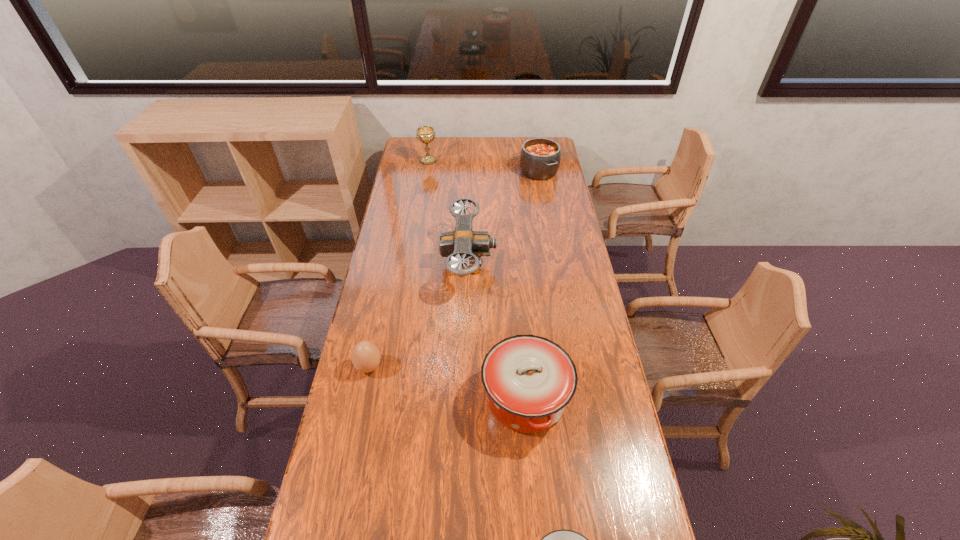
Find the location of a particular element. This screenshot has height=540, width=960. free spot between the fifth tallest object and the chalice is located at coordinates (398, 264).

At what (x,y) coordinates should I click in order to perform the action: click on blank region between the nearer casserole and the chalice. Please return your answer as a coordinate pair (x, y). Looking at the image, I should click on (477, 280).

Locate an element on the screen. free space between the taller casserole and the chalice is located at coordinates (477, 280).

In order to click on unoccupied position between the nearer casserole and the fifth tallest object in this screenshot , I will do `click(447, 382)`.

Locate an element on the screen. This screenshot has height=540, width=960. vacant point located between the chalice and the second shortest object is located at coordinates (398, 264).

The height and width of the screenshot is (540, 960). What are the coordinates of `object that is the fourth closest to the nearer casserole` in the screenshot? It's located at (540, 158).

Identify the location of object identified as the fifth closest to the nearer casserole. (426, 134).

At what (x,y) coordinates should I click in order to perform the action: click on vacant area in the image that satisfies the following two spatial constraints: 1. on the front-facing side of the fourth nearest object; 2. on the left side of the nearer casserole. Please return your answer as a coordinate pair (x, y). Image resolution: width=960 pixels, height=540 pixels. Looking at the image, I should click on (465, 398).